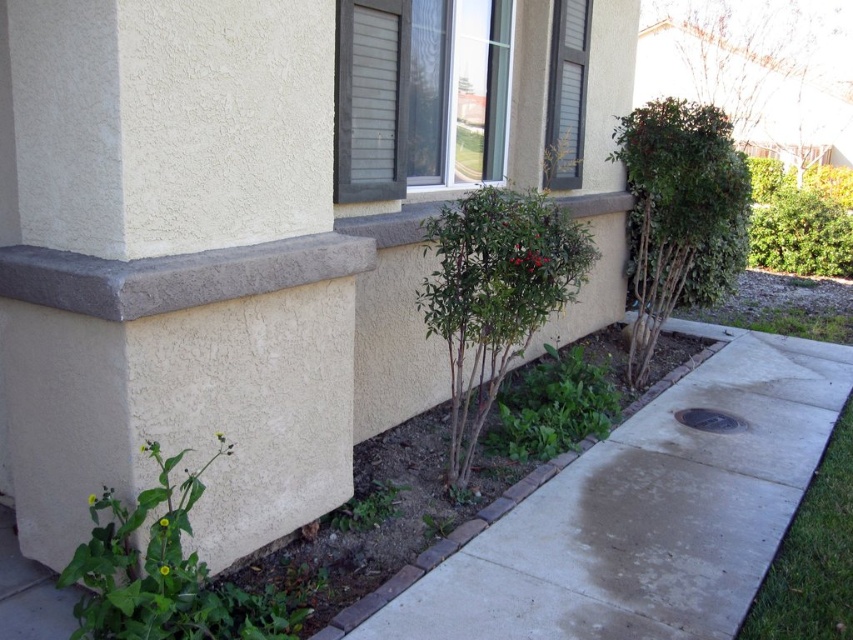
Is green leafy bush at upper right positioned before green leafy bush at right?

No, it is not.

In order to click on green leafy bush at upper right in this screenshot , I will do `click(757, 68)`.

Who is shorter, concrete at center or green leafy bush at center?

concrete at center is shorter.

Does concrete at center have a greater height compared to green leafy bush at center?

No, concrete at center is not taller than green leafy bush at center.

Does point (718, 570) come farther from viewer compared to point (546, 298)?

No, it is not.

At what (x,y) coordinates should I click in order to perform the action: click on concrete at center. Please return your answer as a coordinate pair (x, y). The image size is (853, 640). Looking at the image, I should click on (643, 513).

The width and height of the screenshot is (853, 640). What do you see at coordinates (757, 68) in the screenshot? I see `green leafy bush at upper right` at bounding box center [757, 68].

Between green leafy bush at upper right and green grass at lower right, which one appears on the right side from the viewer's perspective?

green leafy bush at upper right is more to the right.

What are the coordinates of `green leafy bush at upper right` in the screenshot? It's located at (757, 68).

The height and width of the screenshot is (640, 853). Identify the location of green leafy bush at upper right. (757, 68).